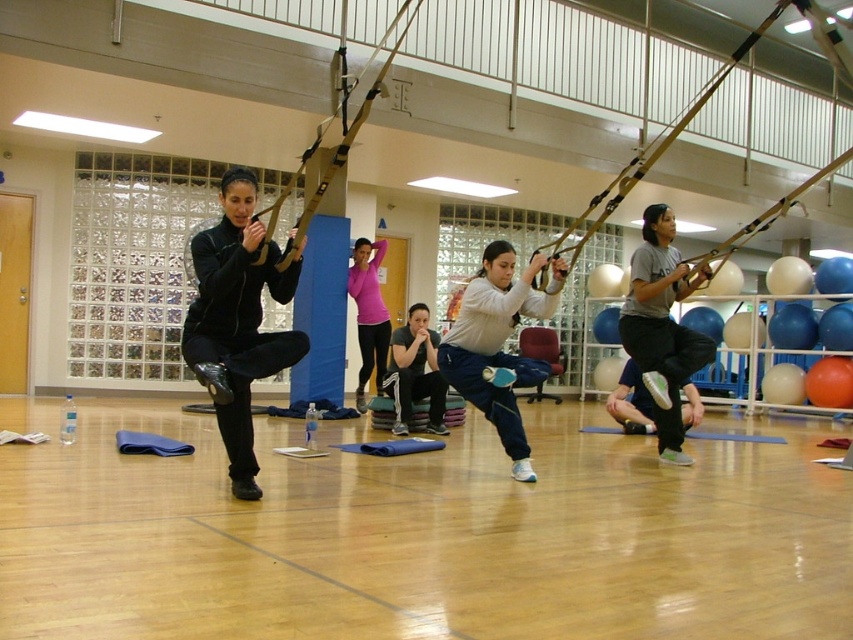
Question: Based on their relative distances, which object is farther from the gray fabric sweatshirt at center?

Choices:
 (A) gray fabric shirt at center
 (B) light gray fabric pants at center

Answer: (A)

Question: Which object is the farthest from the gray fabric shirt at center?

Choices:
 (A) light gray fabric pants at center
 (B) pink fabric at center
 (C) gray fabric sweatshirt at center

Answer: (B)

Question: Which object is positioned closest to the light gray fabric pants at center?

Choices:
 (A) gray fabric sweatshirt at center
 (B) gray fabric shirt at center
 (C) pink fabric at center

Answer: (B)

Question: Does gray fabric shirt at center have a smaller size compared to gray fabric sweatshirt at center?

Choices:
 (A) yes
 (B) no

Answer: (B)

Question: Does light gray fabric pants at center appear on the right side of gray fabric shirt at center?

Choices:
 (A) yes
 (B) no

Answer: (B)

Question: Can you confirm if light gray fabric pants at center is bigger than pink fabric at center?

Choices:
 (A) yes
 (B) no

Answer: (A)